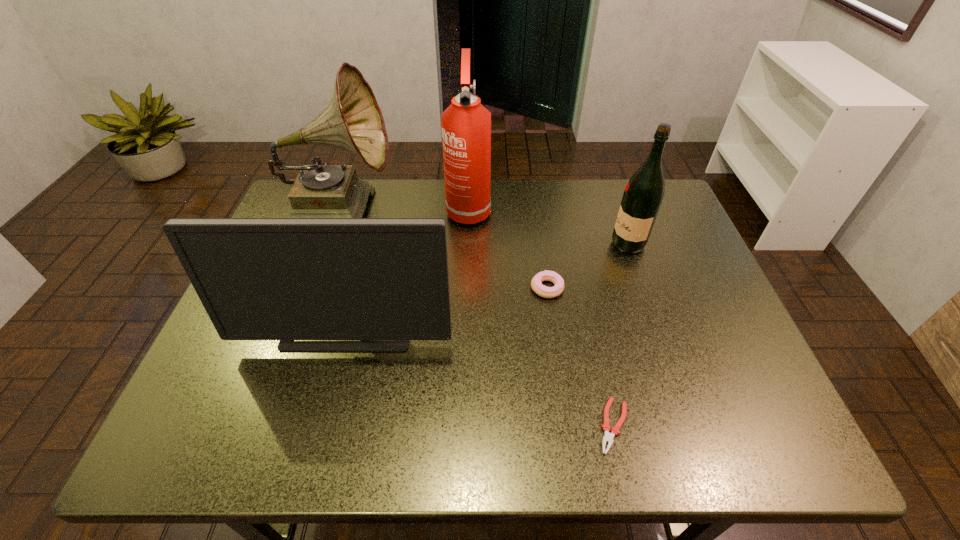
Identify the location of vacant area that lies between the computer monitor and the nearest object. (482, 374).

Identify the location of vacant space that's between the record player and the fire extinguisher. This screenshot has width=960, height=540. (404, 209).

At what (x,y) coordinates should I click in order to perform the action: click on free space between the rightmost object and the computer monitor. Please return your answer as a coordinate pair (x, y). Looking at the image, I should click on (489, 284).

The height and width of the screenshot is (540, 960). I want to click on object that is the third nearest to the fourth object from left to right, so click(466, 124).

Find the location of a particular element. the fourth closest object to the liquor is located at coordinates (285, 279).

Where is `free space in the image that satisfies the following two spatial constraints: 1. from the horn of the third object from right to left; 2. on the left side of the record player`? free space in the image that satisfies the following two spatial constraints: 1. from the horn of the third object from right to left; 2. on the left side of the record player is located at coordinates (312, 288).

Where is `free space that satisfies the following two spatial constraints: 1. from the horn of the nearest object; 2. on the left side of the record player`? The height and width of the screenshot is (540, 960). free space that satisfies the following two spatial constraints: 1. from the horn of the nearest object; 2. on the left side of the record player is located at coordinates (263, 426).

This screenshot has width=960, height=540. Identify the location of free region that satisfies the following two spatial constraints: 1. on the front side of the second object from right to left; 2. on the left side of the fifth tallest object. (566, 426).

Locate an element on the screen. Image resolution: width=960 pixels, height=540 pixels. free point that satisfies the following two spatial constraints: 1. at the nozzle of the nearest object; 2. on the left side of the fire extinguisher is located at coordinates (462, 426).

I want to click on vacant region that satisfies the following two spatial constraints: 1. on the screen side of the computer monitor; 2. on the right side of the shortest object, so click(x=324, y=426).